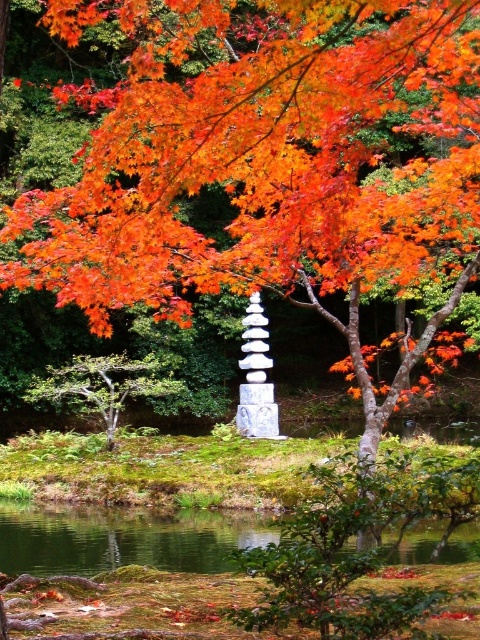
Question: Is green reflective water at lower center thinner than green matte tree at lower left?

Choices:
 (A) yes
 (B) no

Answer: (B)

Question: Which point is closer to the camera?

Choices:
 (A) (64, 518)
 (B) (317, 180)
 (C) (68, 378)

Answer: (B)

Question: Does shiny orange maple at upper center have a lesser width compared to green reflective water at lower center?

Choices:
 (A) yes
 (B) no

Answer: (B)

Question: Does green matte tree at lower left have a smaller size compared to white stone pillar at center?

Choices:
 (A) no
 (B) yes

Answer: (A)

Question: Considering the real-world distances, which object is farthest from the green reflective water at lower center?

Choices:
 (A) green matte tree at lower left
 (B) white stone pillar at center

Answer: (B)

Question: Which of these objects is positioned closest to the white stone pillar at center?

Choices:
 (A) green matte tree at lower left
 (B) shiny orange maple at upper center
 (C) green reflective water at lower center

Answer: (A)